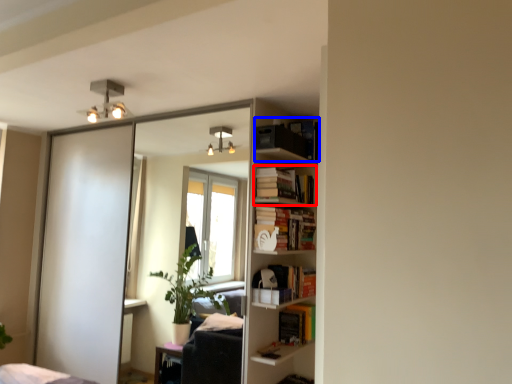
Question: Among these objects, which one is nearest to the camera, book (highlighted by a red box) or book (highlighted by a blue box)?

Choices:
 (A) book
 (B) book

Answer: (B)